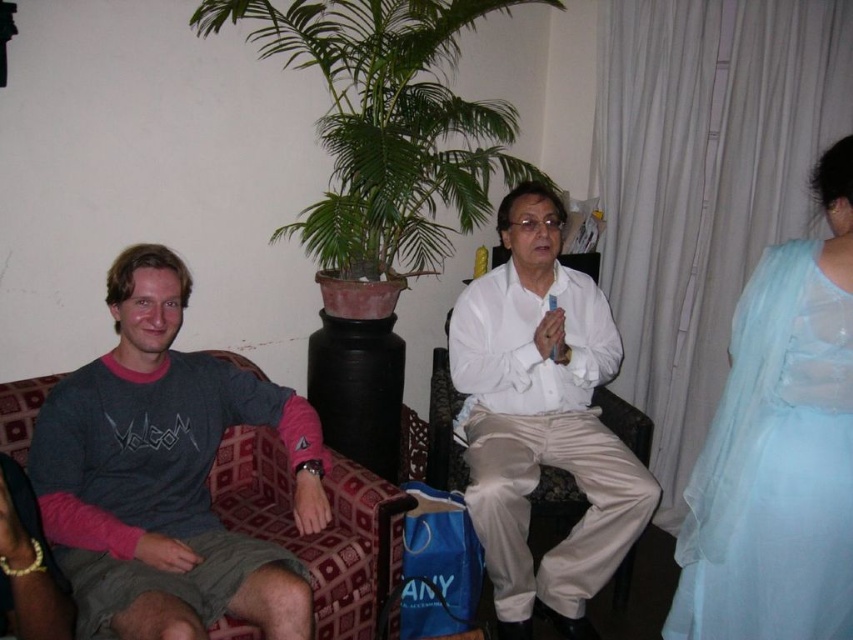
Question: Can you confirm if gray cotton shirt at left is wider than white satin pants at center?

Choices:
 (A) yes
 (B) no

Answer: (A)

Question: Which of the following is the closest to the observer?

Choices:
 (A) coord(827,182)
 (B) coord(527,240)

Answer: (A)

Question: Which object appears closest to the camera in this image?

Choices:
 (A) light blue sheer fabric at right
 (B) gray cotton shirt at left

Answer: (B)

Question: Observing the image, what is the correct spatial positioning of gray cotton shirt at left in reference to light blue sheer fabric at right?

Choices:
 (A) right
 (B) left

Answer: (B)

Question: Which point appears closest to the camera in this image?

Choices:
 (A) (184, 506)
 (B) (581, 419)

Answer: (A)

Question: Is light blue sheer fabric at right to the left of white satin pants at center from the viewer's perspective?

Choices:
 (A) yes
 (B) no

Answer: (B)